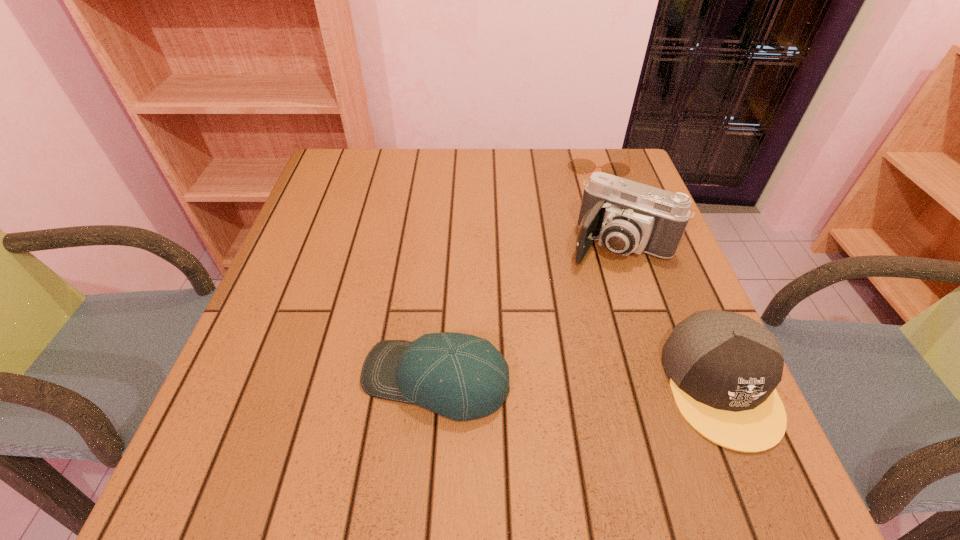
At what (x,y) coordinates should I click in order to perform the action: click on free point between the baseball cap and the shortest object. Please return your answer as a coordinate pair (x, y). This screenshot has height=540, width=960. Looking at the image, I should click on (516, 272).

Image resolution: width=960 pixels, height=540 pixels. I want to click on object that stands as the second closest to the baseball cap, so click(723, 367).

You are a GUI agent. You are given a task and a screenshot of the screen. Output one action in this format:
    pyautogui.click(x=<x>, y=<y>)
    Task: Click on the object that can be found as the third closest to the baseball cap
    The image size is (960, 540).
    Given the screenshot: What is the action you would take?
    pyautogui.click(x=580, y=165)

You are a GUI agent. You are given a task and a screenshot of the screen. Output one action in this format:
    pyautogui.click(x=<x>, y=<y>)
    Task: Click on the vacant position in the image that satisfies the following two spatial constraints: 1. on the back side of the leftmost object; 2. on the right side of the third nearest object
    This screenshot has height=540, width=960.
    Given the screenshot: What is the action you would take?
    pyautogui.click(x=446, y=244)